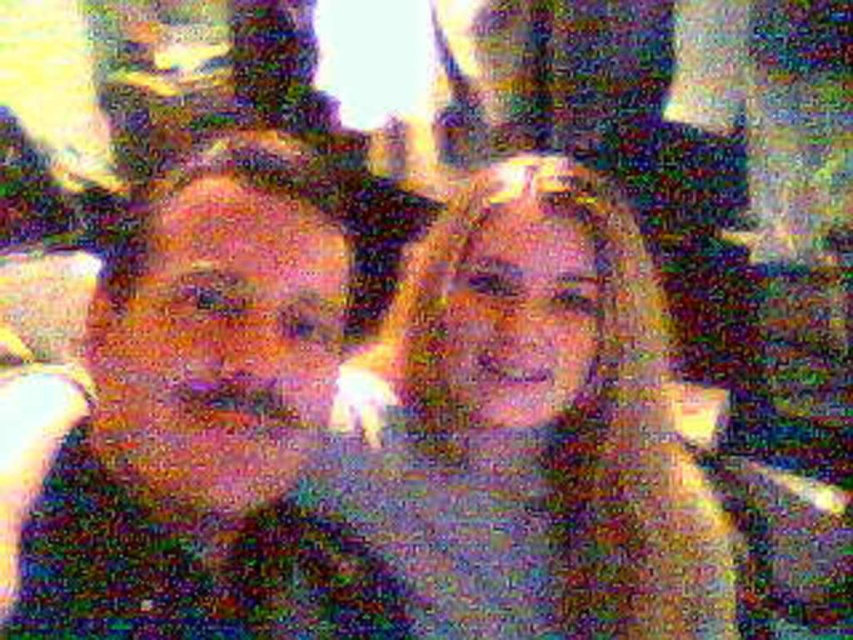
Based on the scene description, where is the matte black face at center located in terms of coordinates?

The matte black face at center is located at coordinates point (196, 410).

Based on the scene description, can you determine if the matte black face at center is closer to the camera than the smooth beige sweater at center?

Yes, the matte black face at center is in front of the smooth beige sweater at center, meaning it is closer to the camera.

You are a photographer reviewing a distorted image. You notice two objects at the center of the image, the matte black face at center and the smooth beige sweater at center. Based on the distortion, can you determine which object is shorter?

The matte black face at center is shorter than the smooth beige sweater at center according to the description.